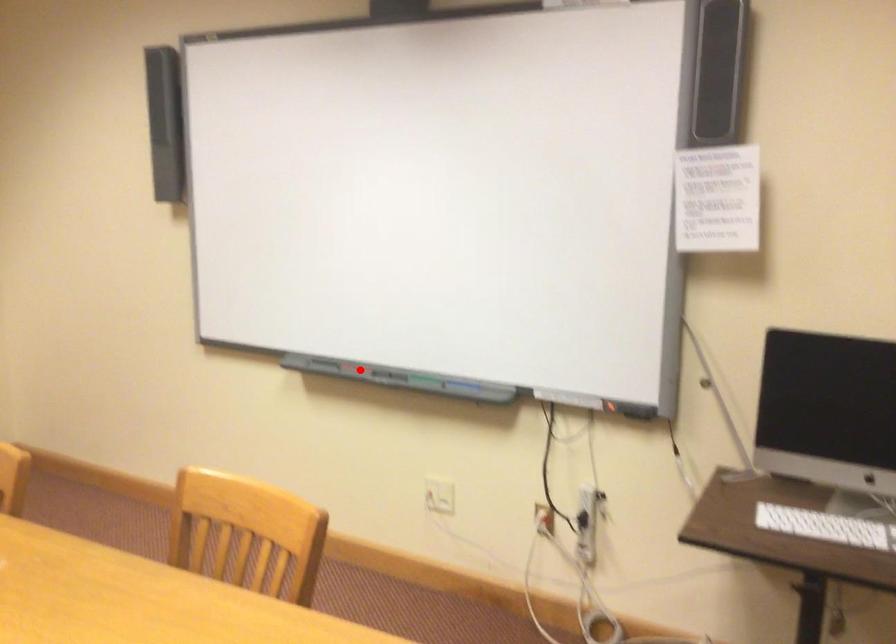
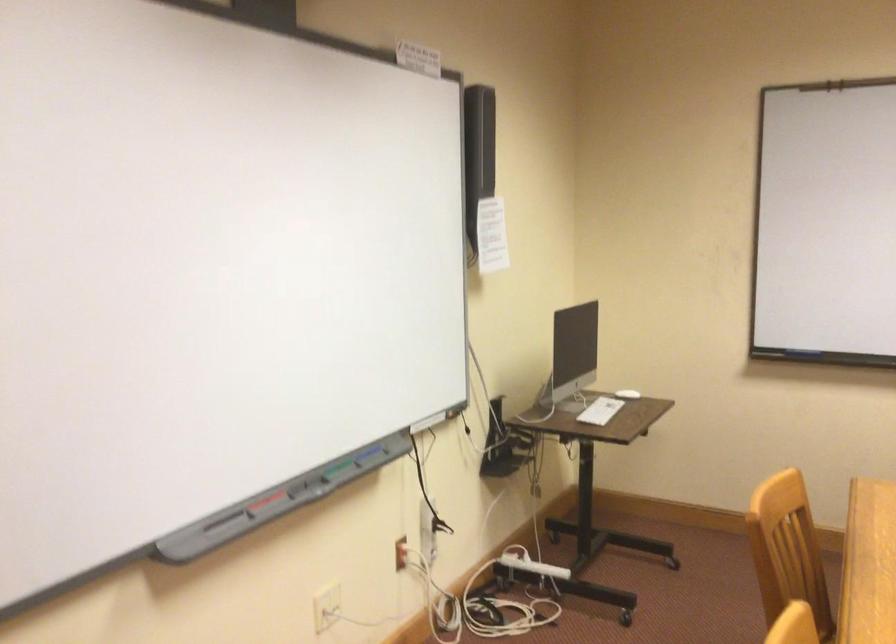
Question: I am providing you with two images of the same scene from different viewpoints. In image1, a red point is highlighted. Considering the same 3D point in image2, which of the following is correct?

Choices:
 (A) It is closer
 (B) It is farther

Answer: (A)